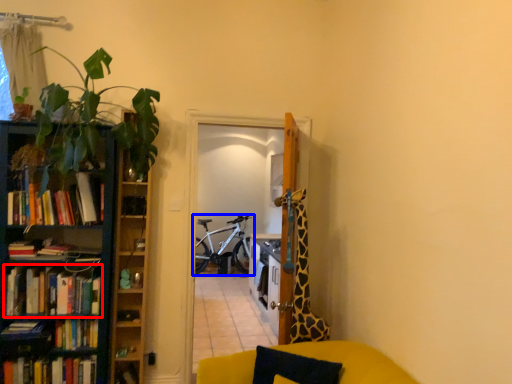
Question: Among these objects, which one is farthest to the camera, book (highlighted by a red box) or bicycle (highlighted by a blue box)?

Choices:
 (A) book
 (B) bicycle

Answer: (B)